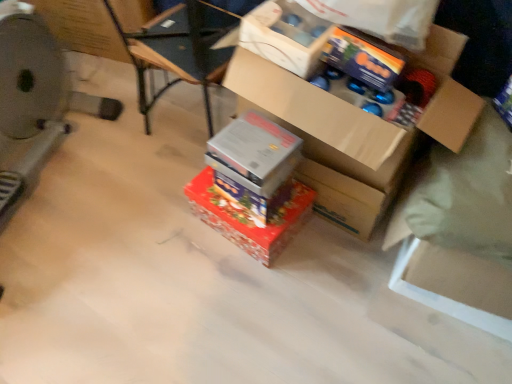
Locate an element on the screen. The height and width of the screenshot is (384, 512). vacant area that lies between metallic silver exercise machine at left and shiny metallic box at center, positioned as the 3th box in top-to-bottom order is located at coordinates (131, 226).